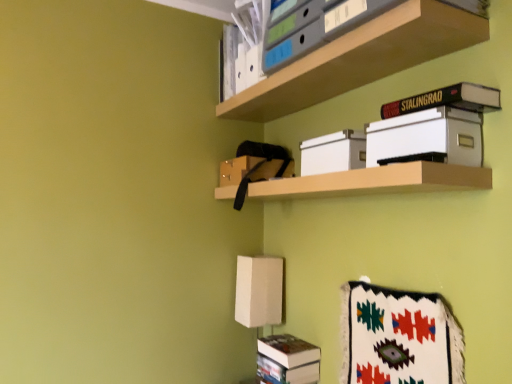
Describe the element at coordinates (360, 59) in the screenshot. Image resolution: width=512 pixels, height=384 pixels. I see `matte plastic folders at upper center, which is the 1th shelf in top-to-bottom order` at that location.

Measure the distance between point (401,352) and camera.

Point (401,352) is 4.18 feet from camera.

What is the approximate width of white woven blanket at lower right?

2.71 inches.

At what (x,y) coordinates should I click in order to perform the action: click on beige fabric lampshade at lower center. Please return your answer as a coordinate pair (x, y). Looking at the image, I should click on coord(260,291).

This screenshot has height=384, width=512. What do you see at coordinates (333, 152) in the screenshot?
I see `white cardboard box at center` at bounding box center [333, 152].

The width and height of the screenshot is (512, 384). Describe the element at coordinates (376, 181) in the screenshot. I see `wooden shelf at center, which ranks as the 2th shelf in top-to-bottom order` at that location.

At what (x,y) coordinates should I click in order to perform the action: click on matte plastic folders at upper center, which is the 1th shelf in top-to-bottom order. Please return your answer as a coordinate pair (x, y). Looking at the image, I should click on (360, 59).

Between point (272, 272) and point (339, 161), which one is positioned in front?

Point (339, 161)

How distant is beige fabric lampshade at lower center from white cardboard box at center?

beige fabric lampshade at lower center is 24.07 inches from white cardboard box at center.

Which object is closer to the camera taking this photo, beige fabric lampshade at lower center or white cardboard box at center?

white cardboard box at center.

Between beige fabric lampshade at lower center and white cardboard box at center, which one has smaller size?

Smaller between the two is white cardboard box at center.

Considering the sizes of objects hardcover black book at upper right and white cardboard box at center in the image provided, who is thinner, hardcover black book at upper right or white cardboard box at center?

white cardboard box at center.

From the image's perspective, is hardcover black book at upper right under white cardboard box at center?

No, from the image's perspective, hardcover black book at upper right is not beneath white cardboard box at center.

Between hardcover black book at upper right and white cardboard box at center, which one appears on the left side from the viewer's perspective?

Positioned to the left is white cardboard box at center.

From a real-world perspective, is matte plastic folders at upper center, which is the 1th shelf in top-to-bottom order, physically below hardcover black book at upper right?

No, from a real-world perspective, matte plastic folders at upper center, which is the 1th shelf in top-to-bottom order, is not beneath hardcover black book at upper right.

From the image's perspective, which is above, matte plastic folders at upper center, which is the 1th shelf in top-to-bottom order, or hardcover black book at upper right?

From the image's view, matte plastic folders at upper center, which is the 1th shelf in top-to-bottom order, is above.

In terms of size, does matte plastic folders at upper center, which is the 1th shelf in top-to-bottom order, appear bigger or smaller than hardcover black book at upper right?

matte plastic folders at upper center, which is the 1th shelf in top-to-bottom order, is bigger than hardcover black book at upper right.

Which is correct: beige fabric lampshade at lower center is inside hardcover black book at upper right, or outside of it?

beige fabric lampshade at lower center cannot be found inside hardcover black book at upper right.

Who is taller, beige fabric lampshade at lower center or hardcover black book at upper right?

beige fabric lampshade at lower center is taller.

This screenshot has width=512, height=384. Find the location of `table lamp on the left of hardcover black book at upper right`. table lamp on the left of hardcover black book at upper right is located at coordinates (260, 291).

Could you tell me if beige fabric lampshade at lower center is turned towards hardcover black book at upper right?

No, beige fabric lampshade at lower center is not facing towards hardcover black book at upper right.

Considering the relative sizes of white woven blanket at lower right and white cardboard box at center in the image provided, is white woven blanket at lower right smaller than white cardboard box at center?

No.

Is the surface of white woven blanket at lower right in direct contact with white cardboard box at center?

No, white woven blanket at lower right is not beside white cardboard box at center.

How different are the orientations of white woven blanket at lower right and white cardboard box at center in degrees?

There is a 0.999-degree angle between the facing directions of white woven blanket at lower right and white cardboard box at center.

From a real-world perspective, is white woven blanket at lower right under white cardboard box at center?

Indeed, from a real-world perspective, white woven blanket at lower right is positioned beneath white cardboard box at center.

Which of these two, beige fabric lampshade at lower center or white woven blanket at lower right, is bigger?

Bigger between the two is beige fabric lampshade at lower center.

The width and height of the screenshot is (512, 384). Find the location of `table lamp below the white woven blanket at lower right (from a real-world perspective)`. table lamp below the white woven blanket at lower right (from a real-world perspective) is located at coordinates (260, 291).

Consider the image. Is beige fabric lampshade at lower center looking in the opposite direction of white woven blanket at lower right?

beige fabric lampshade at lower center does not have its back to white woven blanket at lower right.

From the image's perspective, which one is positioned lower, matte plastic folders at upper center, which is the 1th shelf in top-to-bottom order, or beige fabric lampshade at lower center?

beige fabric lampshade at lower center, from the image's perspective.

From a real-world perspective, which object stands above the other?

matte plastic folders at upper center, which ranks as the 2th shelf in bottom-to-top order, is physically above.

Considering the relative positions of matte plastic folders at upper center, which is the 1th shelf in top-to-bottom order, and beige fabric lampshade at lower center in the image provided, is matte plastic folders at upper center, which is the 1th shelf in top-to-bottom order, to the right of beige fabric lampshade at lower center from the viewer's perspective?

Correct, you'll find matte plastic folders at upper center, which is the 1th shelf in top-to-bottom order, to the right of beige fabric lampshade at lower center.

Based on the photo, looking at the image, does matte plastic folders at upper center, which ranks as the 2th shelf in bottom-to-top order, seem bigger or smaller compared to beige fabric lampshade at lower center?

Considering their sizes, matte plastic folders at upper center, which ranks as the 2th shelf in bottom-to-top order, takes up more space than beige fabric lampshade at lower center.

Identify the location of box above the beige fabric lampshade at lower center (from the image's perspective). Image resolution: width=512 pixels, height=384 pixels. (333, 152).

Locate an element on the screen. paperback book above the white cardboard box at center (from a real-world perspective) is located at coordinates click(447, 100).

From the picture: Estimate the real-world distances between objects in this image. Which object is further from white woven blanket at lower right, beige fabric lampshade at lower center or white cardboard box at center?

beige fabric lampshade at lower center is further to white woven blanket at lower right.

Looking at the image, which one is located closer to matte plastic folders at upper center, which ranks as the 2th shelf in bottom-to-top order, hardcover black book at upper right or white cardboard box at center?

Based on the image, hardcover black book at upper right appears to be nearer to matte plastic folders at upper center, which ranks as the 2th shelf in bottom-to-top order.

Estimate the real-world distances between objects in this image. Which object is further from beige fabric lampshade at lower center, white cardboard box at center or matte plastic folders at upper center, which is the 1th shelf in top-to-bottom order?

matte plastic folders at upper center, which is the 1th shelf in top-to-bottom order, is further to beige fabric lampshade at lower center.

When comparing their distances from wooden shelf at center, which ranks as the 2th shelf in top-to-bottom order, does beige fabric lampshade at lower center or white woven blanket at lower right seem closer?

Based on the image, white woven blanket at lower right appears to be nearer to wooden shelf at center, which ranks as the 2th shelf in top-to-bottom order.

From the image, which object appears to be farther from white woven blanket at lower right, white cardboard box at center or wooden shelf at center, which ranks as the 2th shelf in top-to-bottom order?

The object further to white woven blanket at lower right is white cardboard box at center.

Considering their positions, is white woven blanket at lower right positioned closer to beige fabric lampshade at lower center than matte plastic folders at upper center, which ranks as the 2th shelf in bottom-to-top order?

white woven blanket at lower right is positioned closer to the anchor beige fabric lampshade at lower center.

When comparing their distances from white woven blanket at lower right, does beige fabric lampshade at lower center or wooden shelf at center, which ranks as the 2th shelf in top-to-bottom order, seem further?

beige fabric lampshade at lower center is positioned further to the anchor white woven blanket at lower right.

Considering their positions, is wooden shelf at center, which ranks as the 2th shelf in top-to-bottom order, positioned further to white cardboard box at center than hardcover black book at upper right?

hardcover black book at upper right is further to white cardboard box at center.

Identify the location of paperback book between matte plastic folders at upper center, which ranks as the 2th shelf in bottom-to-top order, and wooden shelf at center, which ranks as the 2th shelf in top-to-bottom order, in the up-down direction. This screenshot has height=384, width=512. (447, 100).

Identify the location of blanket between wooden shelf at center, the 1th shelf from the bottom, and beige fabric lampshade at lower center, along the z-axis. (398, 337).

Locate an element on the screen. box between hardcover black book at upper right and white woven blanket at lower right in the up-down direction is located at coordinates (333, 152).

The image size is (512, 384). What are the coordinates of `paperback book located between wooden shelf at center, the 1th shelf from the bottom, and white cardboard box at center in the depth direction` in the screenshot? It's located at [x=447, y=100].